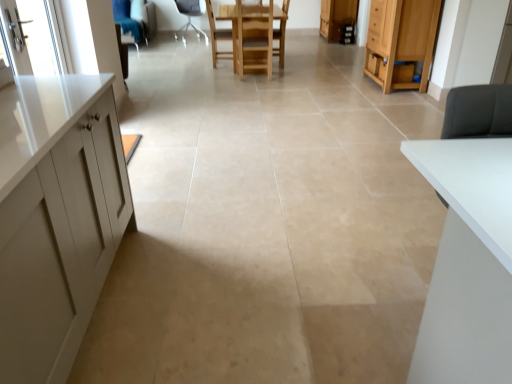
Question: Is wooden cabinet at right, the second cabinetry when ordered from back to front, facing away from wooden chair at center, which ranks as the 2th chair in right-to-left order?

Choices:
 (A) yes
 (B) no

Answer: (B)

Question: Is wooden cabinet at right, which is the second cabinetry from top to bottom, positioned far away from wooden chair at center, which appears as the second chair when viewed from the front?

Choices:
 (A) no
 (B) yes

Answer: (B)

Question: Does wooden cabinet at right, which is the second cabinetry from top to bottom, have a lesser height compared to wooden chair at center, the 2th chair when ordered from left to right?

Choices:
 (A) yes
 (B) no

Answer: (B)

Question: Is wooden cabinet at right, the first cabinetry when ordered from bottom to top, outside of wooden chair at center, which appears as the second chair when viewed from the front?

Choices:
 (A) yes
 (B) no

Answer: (A)

Question: Does wooden cabinet at right, positioned as the 1th cabinetry in front-to-back order, touch wooden chair at center, the 2th chair when ordered from left to right?

Choices:
 (A) no
 (B) yes

Answer: (A)

Question: Does wooden cabinet at right, which is the second cabinetry from top to bottom, turn towards wooden chair at center, the 2th chair when ordered from left to right?

Choices:
 (A) yes
 (B) no

Answer: (B)

Question: Considering the relative sizes of wooden chair at center, the first chair in the front-to-back sequence, and white fabric chair at center, the first chair from the back, in the image provided, is wooden chair at center, the first chair in the front-to-back sequence, taller than white fabric chair at center, the first chair from the back,?

Choices:
 (A) no
 (B) yes

Answer: (B)

Question: From a real-world perspective, is wooden chair at center, the first chair in the front-to-back sequence, on top of white fabric chair at center, placed as the 3th chair when sorted from front to back?

Choices:
 (A) yes
 (B) no

Answer: (A)

Question: Is wooden chair at center, the first chair viewed from the right, positioned in front of white fabric chair at center, the first chair from the back?

Choices:
 (A) no
 (B) yes

Answer: (B)

Question: Is wooden chair at center, the first chair viewed from the right, shorter than white fabric chair at center, placed as the 3th chair when sorted from front to back?

Choices:
 (A) yes
 (B) no

Answer: (B)

Question: Does wooden chair at center, marked as the 3th chair in a left-to-right arrangement, have a smaller size compared to white fabric chair at center, the first chair positioned from the left?

Choices:
 (A) no
 (B) yes

Answer: (B)

Question: Can you confirm if wooden chair at center, the 3th chair viewed from the back, is positioned to the right of white fabric chair at center, placed as the 3th chair when sorted from front to back?

Choices:
 (A) no
 (B) yes

Answer: (B)

Question: Would you say wooden cabinet at upper right, positioned as the second cabinetry in bottom-to-top order, contains clear glass screen door at upper left?

Choices:
 (A) no
 (B) yes

Answer: (A)